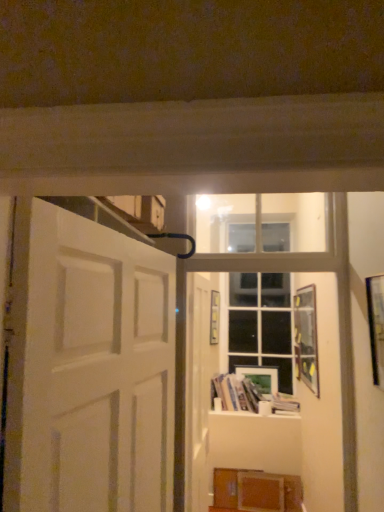
Question: Considering the positions of point (269, 369) and point (200, 330), is point (269, 369) closer or farther from the camera than point (200, 330)?

Choices:
 (A) farther
 (B) closer

Answer: (A)

Question: From a real-world perspective, is matte wooden picture frame at center, which ranks as the 4th picture frame in front-to-back order, above or below white matte door at center, placed as the first door when sorted from back to front?

Choices:
 (A) below
 (B) above

Answer: (A)

Question: Which is farther from the wooden cabinet at lower right?

Choices:
 (A) metallic silver picture frame at right, the second picture frame from the right
 (B) white matte door at left, the 2th door in the back-to-front sequence
 (C) clear glass window at center
 (D) wooden picture frame at center, which is the fourth picture frame from right to left
 (E) wooden picture frame at upper right, arranged as the first picture frame when viewed from the right

Answer: (B)

Question: Which object is the closest to the white matte door at left, placed as the 1th door when sorted from left to right?

Choices:
 (A) wooden picture frame at upper right, arranged as the first picture frame when viewed from the right
 (B) white matte door at center, placed as the first door when sorted from back to front
 (C) clear glass window at center
 (D) wooden cabinet at lower right
 (E) white glossy bookshelf at lower center

Answer: (B)